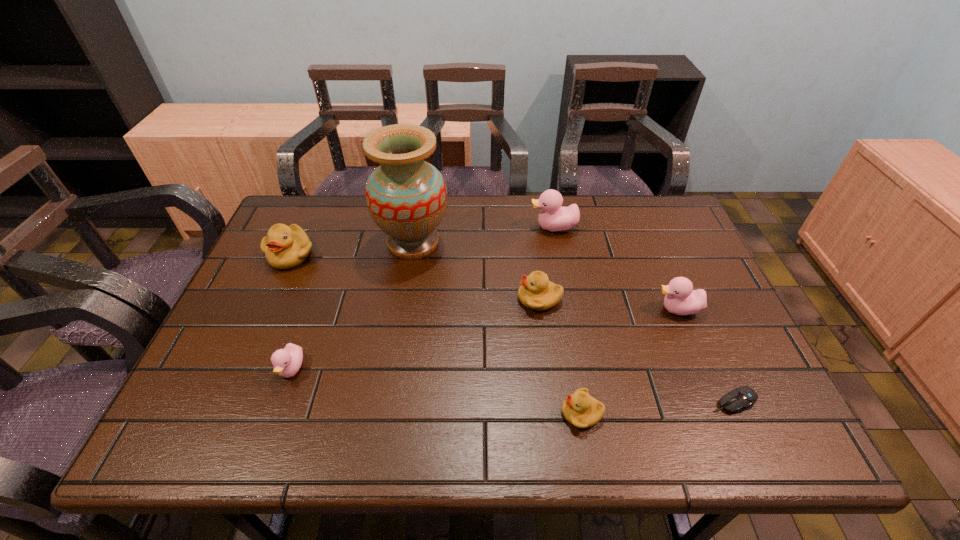
Locate an element on the screen. The height and width of the screenshot is (540, 960). unoccupied area between the sixth object from right to left and the shortest object is located at coordinates (574, 322).

Locate an element on the screen. The width and height of the screenshot is (960, 540). empty space that is in between the second duckling from left to right and the second smallest pink duckling is located at coordinates (485, 339).

Where is `vacant area that lies between the nearest yellow duckling and the second pink duckling from left to right`? The width and height of the screenshot is (960, 540). vacant area that lies between the nearest yellow duckling and the second pink duckling from left to right is located at coordinates (567, 320).

Where is `free space between the second smallest yellow duckling and the biggest pink duckling`? The image size is (960, 540). free space between the second smallest yellow duckling and the biggest pink duckling is located at coordinates (546, 263).

Where is `object that stands as the third closest to the nearest pink duckling`? object that stands as the third closest to the nearest pink duckling is located at coordinates (536, 292).

Identify the location of object that is the closest one to the computer mouse. click(x=681, y=299).

Locate which duckling is the closest to the nearest yellow duckling. Please provide its 2D coordinates. Your answer should be formatted as a tuple, i.e. [(x, y)], where the tuple contains the x and y coordinates of a point satisfying the conditions above.

[(536, 292)]

Select which duckling is the second closest to the tallest object. Please provide its 2D coordinates. Your answer should be formatted as a tuple, i.e. [(x, y)], where the tuple contains the x and y coordinates of a point satisfying the conditions above.

[(536, 292)]

What are the coordinates of `pink duckling that is the second closest one to the leftmost duckling` in the screenshot? It's located at (553, 217).

Point out which pink duckling is positioned as the nearest to the leftmost object. Please provide its 2D coordinates. Your answer should be formatted as a tuple, i.e. [(x, y)], where the tuple contains the x and y coordinates of a point satisfying the conditions above.

[(287, 362)]